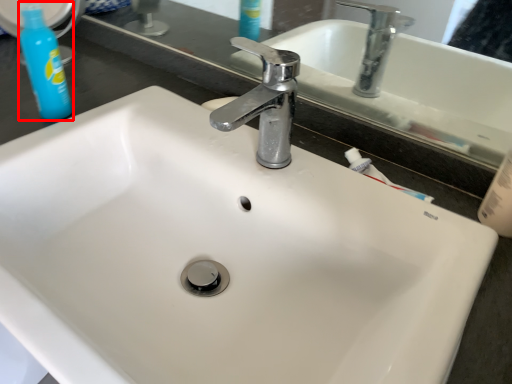
Question: From the image's perspective, considering the relative positions of cleaning product (annotated by the red box) and tap in the image provided, where is cleaning product (annotated by the red box) located with respect to the staircase?

Choices:
 (A) below
 (B) above

Answer: (B)